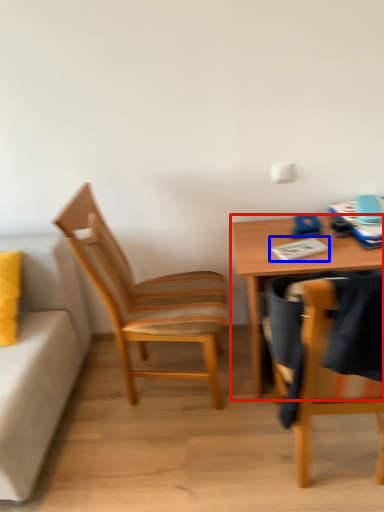
Question: Which object is further to the camera taking this photo, desk (highlighted by a red box) or notepad (highlighted by a blue box)?

Choices:
 (A) desk
 (B) notepad

Answer: (B)